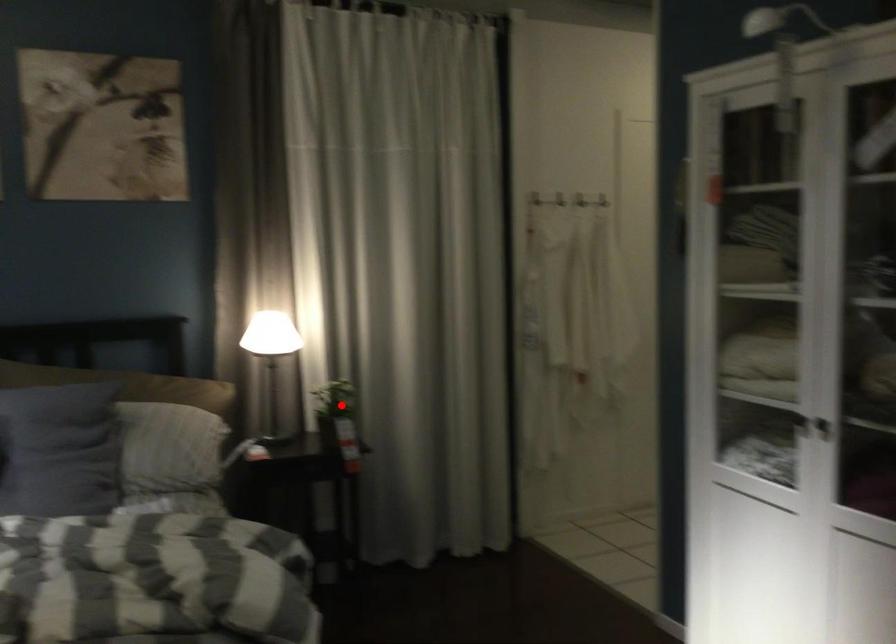
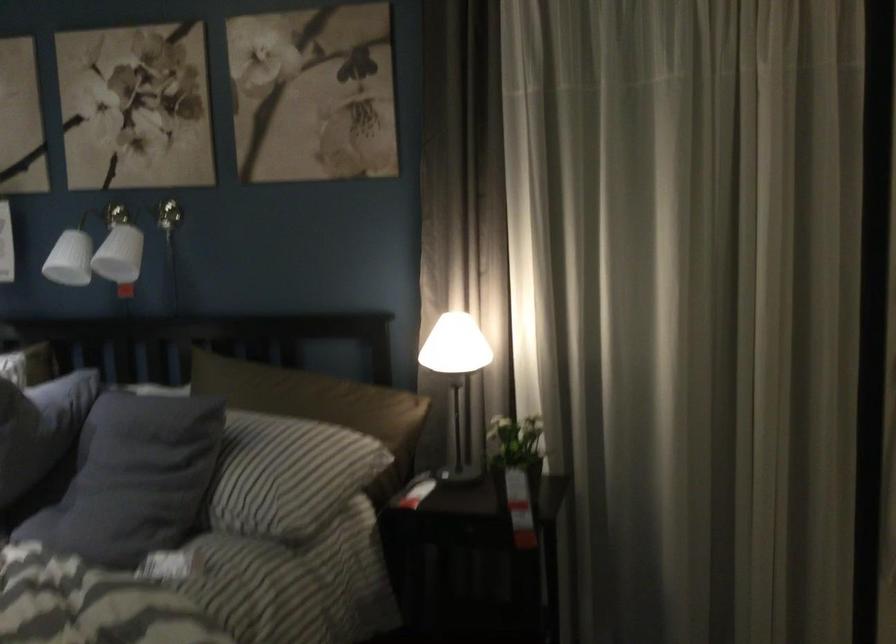
Where in the second image is the point corresponding to the highlighted location from the first image?

(515, 451)